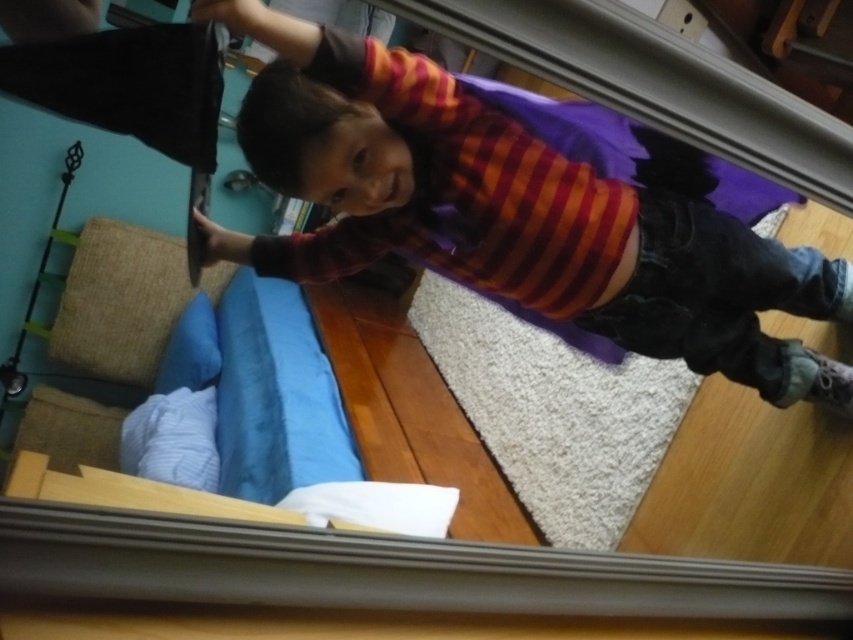
You are standing in a room where there are two points marked on the wall. The first point is at coordinates point (111,346) and the second point is at point (184,403). Which point is closer to you?

Point (111,346) is closer to you because it is further to the camera than point (184,403).